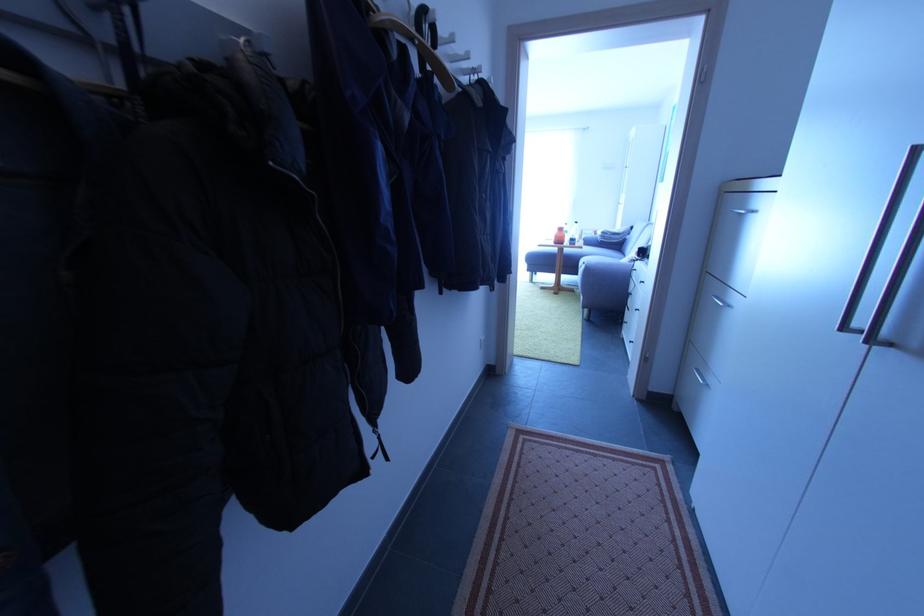
What are the coordinates of `orange bottle` in the screenshot? It's located at (x=558, y=236).